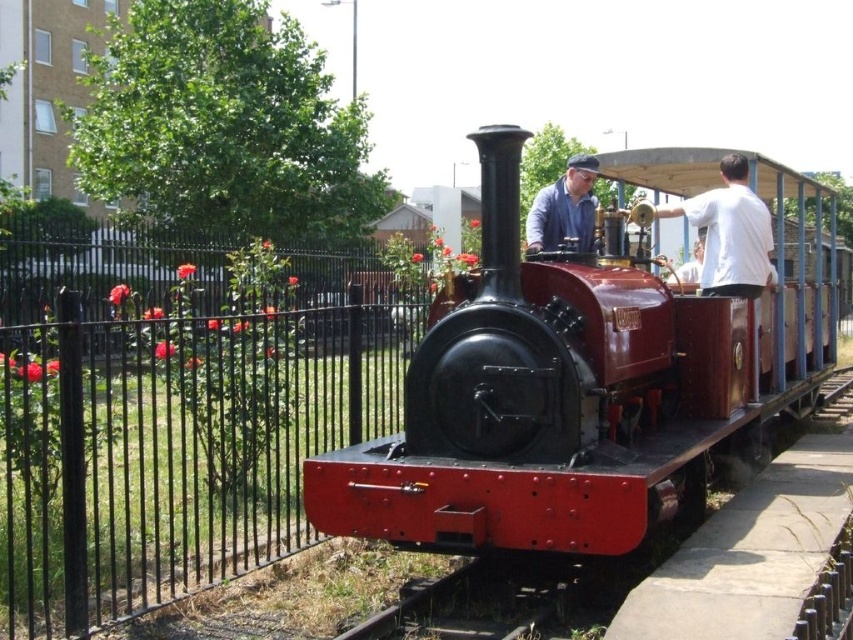
This screenshot has height=640, width=853. I want to click on black metal fence at left, so click(169, 454).

Is black metal fence at left to the right of white cotton shirt at upper right from the viewer's perspective?

In fact, black metal fence at left is to the left of white cotton shirt at upper right.

Does point (282, 531) come closer to viewer compared to point (729, 179)?

Yes, it is.

Locate an element on the screen. black metal fence at left is located at coordinates (169, 454).

Who is shorter, white cotton shirt at upper right or matte blue shirt at center?

Standing shorter between the two is matte blue shirt at center.

Between white cotton shirt at upper right and matte blue shirt at center, which one is positioned lower?

→ white cotton shirt at upper right is below.

Is point (712, 252) closer to camera compared to point (578, 196)?

That is False.

Locate an element on the screen. The width and height of the screenshot is (853, 640). white cotton shirt at upper right is located at coordinates [x=729, y=232].

Does black metal fence at left appear under matte blue shirt at center?

Correct, black metal fence at left is located below matte blue shirt at center.

The image size is (853, 640). What are the coordinates of `black metal fence at left` in the screenshot? It's located at (169, 454).